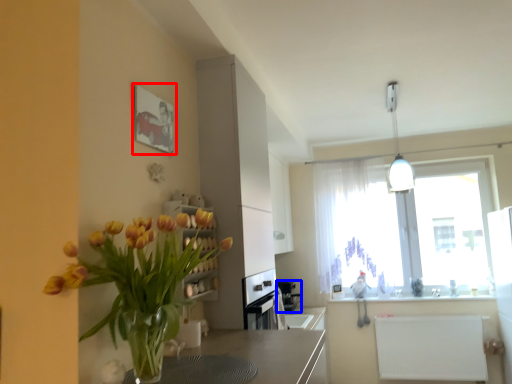
Question: Which object appears farthest to the camera in this image, picture frame (highlighted by a red box) or appliance (highlighted by a blue box)?

Choices:
 (A) picture frame
 (B) appliance

Answer: (B)